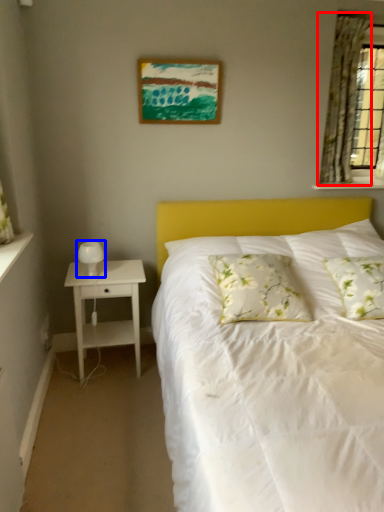
Question: Which point is closer to the camera, curtain (highlighted by a red box) or table lamp (highlighted by a blue box)?

Choices:
 (A) curtain
 (B) table lamp

Answer: (B)